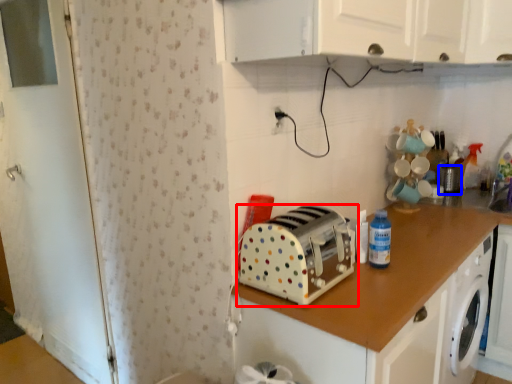
Question: Which of the following is the closest to the observer, toaster (highlighted by a red box) or appliance (highlighted by a blue box)?

Choices:
 (A) toaster
 (B) appliance

Answer: (A)